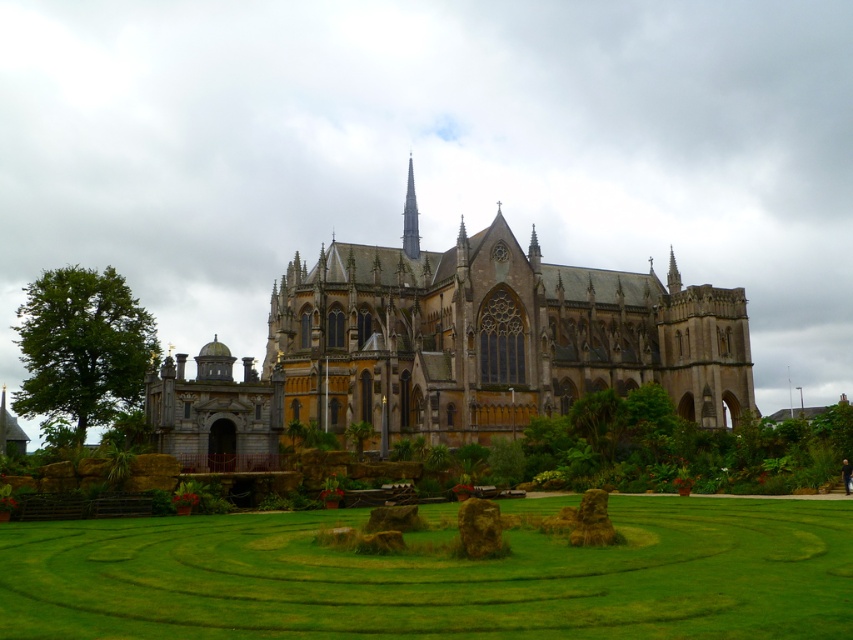
Question: Does green grass maze at center have a larger size compared to yellow stone church at center?

Choices:
 (A) no
 (B) yes

Answer: (A)

Question: Is green grass maze at center above yellow stone church at center?

Choices:
 (A) yes
 (B) no

Answer: (B)

Question: Does green grass maze at center have a lesser width compared to yellow stone church at center?

Choices:
 (A) yes
 (B) no

Answer: (A)

Question: Which point is farther from the camera taking this photo?

Choices:
 (A) (444, 577)
 (B) (677, 285)

Answer: (B)

Question: Which point is farther from the camera taking this photo?

Choices:
 (A) (511, 385)
 (B) (773, 547)

Answer: (A)